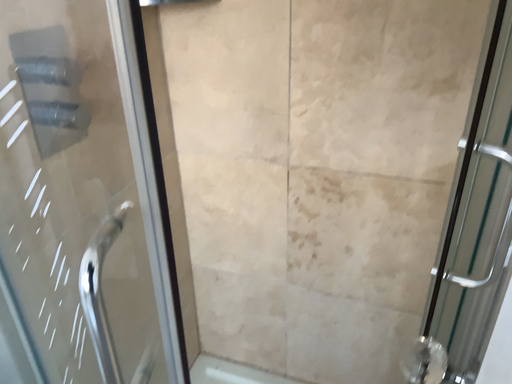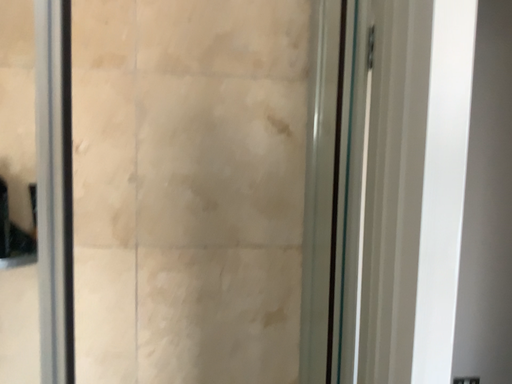
Question: How did the camera likely rotate when shooting the video?

Choices:
 (A) rotated right
 (B) rotated left

Answer: (A)